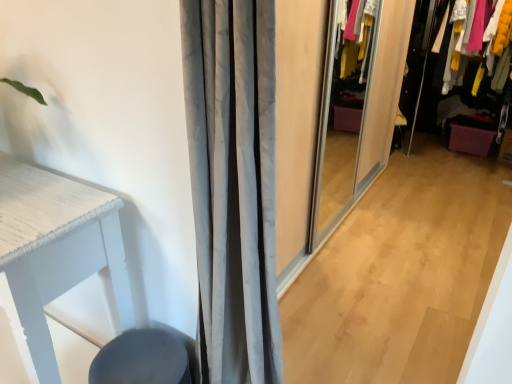
Find the location of `free space above matte black swivel chair at lower left (from a real-world perspective)`. free space above matte black swivel chair at lower left (from a real-world perspective) is located at coordinates (140, 358).